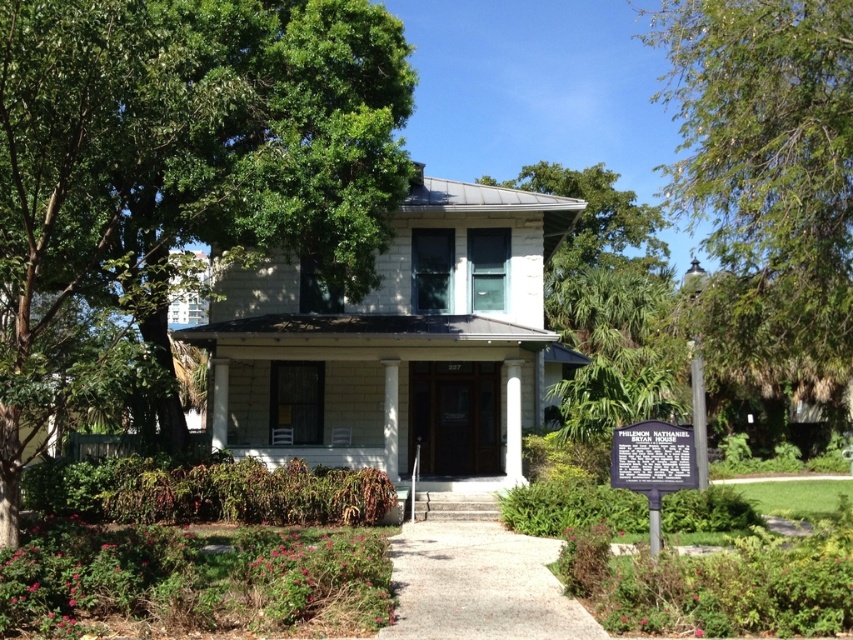
Is green leafy tree at upper left thinner than white smooth column at center?

In fact, green leafy tree at upper left might be wider than white smooth column at center.

I want to click on green leafy tree at upper left, so click(x=177, y=173).

Who is more distant from viewer, (125, 116) or (520, 420)?

Point (520, 420)

Locate an element on the screen. Image resolution: width=853 pixels, height=640 pixels. green leafy tree at upper left is located at coordinates (177, 173).

Can you confirm if green leafy tree at right is positioned to the left of white wood column at center?

Incorrect, green leafy tree at right is not on the left side of white wood column at center.

Does green leafy tree at right have a greater height compared to white wood column at center?

Indeed, green leafy tree at right has a greater height compared to white wood column at center.

Between point (809, 385) and point (387, 396), which one is positioned in front?

Point (387, 396) is more forward.

I want to click on green leafy tree at right, so click(x=767, y=182).

Can you confirm if green leafy tree at upper center is taller than white wood column at center?

Correct, green leafy tree at upper center is much taller as white wood column at center.

Does green leafy tree at upper center have a lesser width compared to white wood column at center?

No, green leafy tree at upper center is not thinner than white wood column at center.

Find the location of a particular element. green leafy tree at upper center is located at coordinates click(596, 220).